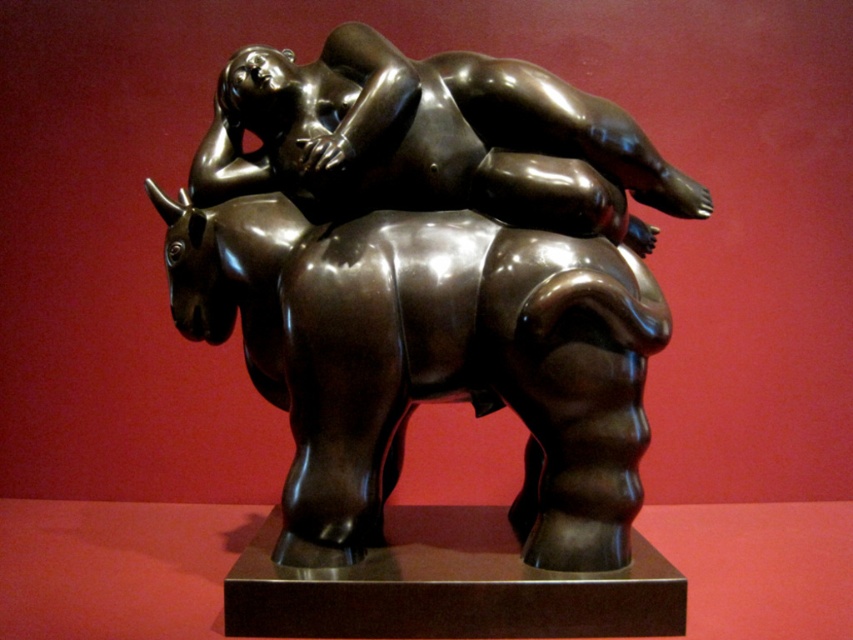
Can you confirm if shiny bronze statue at center is positioned below bronze figure at center?

Correct, shiny bronze statue at center is located below bronze figure at center.

Which is more to the right, shiny bronze statue at center or bronze figure at center?

From the viewer's perspective, bronze figure at center appears more on the right side.

At what (x,y) coordinates should I click in order to perform the action: click on shiny bronze statue at center. Please return your answer as a coordinate pair (x, y). The width and height of the screenshot is (853, 640). Looking at the image, I should click on (428, 278).